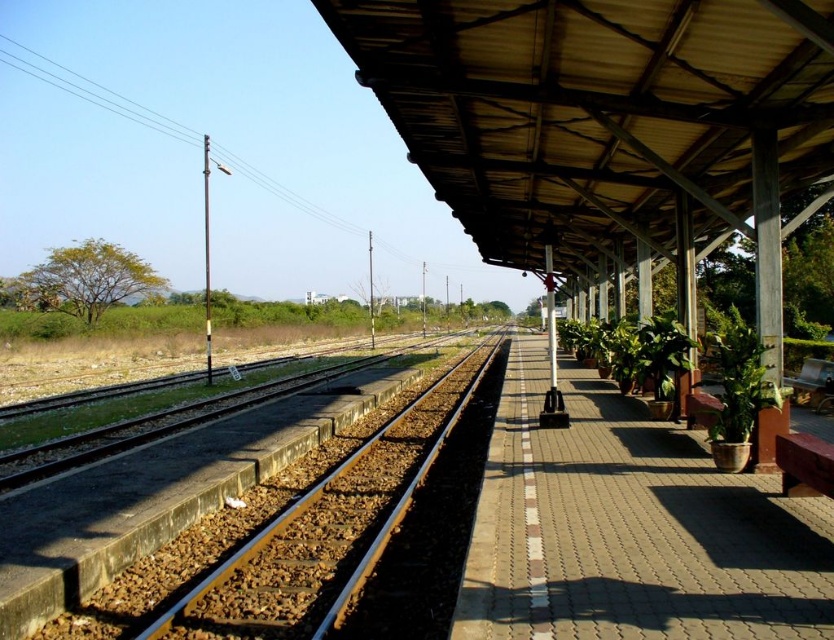
Question: Does green leafy plants at center have a greater width compared to metal at left?

Choices:
 (A) yes
 (B) no

Answer: (A)

Question: Which object appears farthest from the camera in this image?

Choices:
 (A) green leafy plants at center
 (B) metal at left

Answer: (B)

Question: Does green leafy plants at center appear on the left side of metal at left?

Choices:
 (A) yes
 (B) no

Answer: (B)

Question: Can you confirm if green leafy plants at center is positioned below metal at left?

Choices:
 (A) yes
 (B) no

Answer: (B)

Question: Among these objects, which one is nearest to the camera?

Choices:
 (A) green leafy plants at center
 (B) metal at left

Answer: (A)